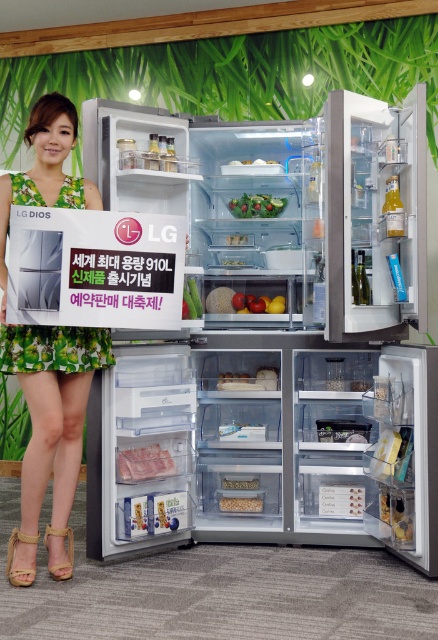
Describe the element at coordinates (301, 317) in the screenshot. I see `sleek stainless steel refrigerator at center` at that location.

Which is in front, point (216, 403) or point (2, 246)?

Positioned in front is point (2, 246).

Locate an element on the screen. sleek stainless steel refrigerator at center is located at coordinates (301, 317).

Based on the photo, between sleek stainless steel refrigerator at center and white matte rice at center, which one appears on the left side from the viewer's perspective?

white matte rice at center

How far apart are sleek stainless steel refrigerator at center and white matte rice at center?

sleek stainless steel refrigerator at center is 3.56 feet from white matte rice at center.

Does point (300, 529) lie behind point (240, 504)?

That is False.

The width and height of the screenshot is (438, 640). I want to click on sleek stainless steel refrigerator at center, so click(x=301, y=317).

Is green floral dress at left shorter than green leafy salad at center?

In fact, green floral dress at left may be taller than green leafy salad at center.

Is green floral dress at left closer to the viewer compared to green leafy salad at center?

That is True.

This screenshot has height=640, width=438. Find the location of `green floral dress at left`. green floral dress at left is located at coordinates (49, 353).